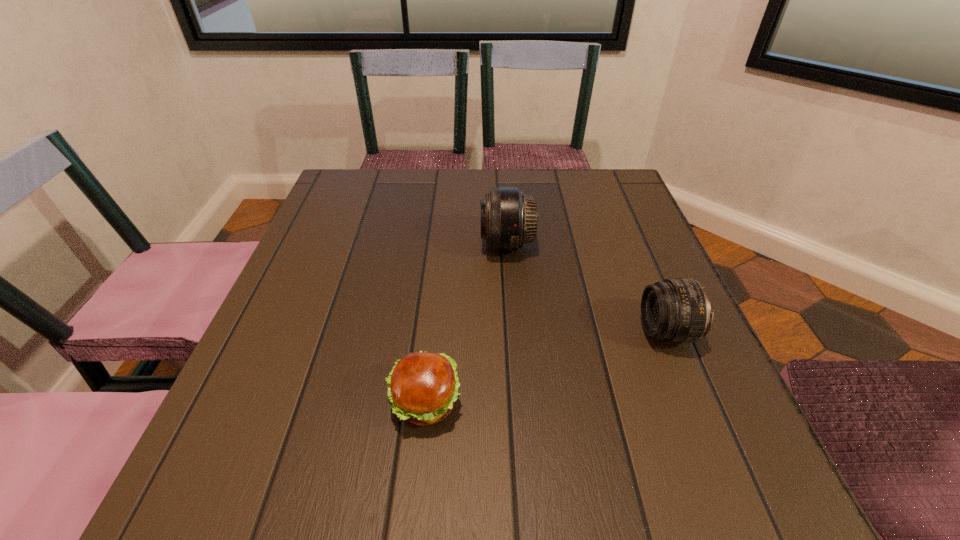
I want to click on free spot located 0.190m at the front element of the rightmost object, so click(539, 332).

Where is `vacant space located at the front element of the rightmost object`? The width and height of the screenshot is (960, 540). vacant space located at the front element of the rightmost object is located at coordinates (582, 332).

Where is `vacant space positioned on the back of the shortest object`? The width and height of the screenshot is (960, 540). vacant space positioned on the back of the shortest object is located at coordinates (434, 320).

I want to click on object located at the right edge, so click(677, 310).

I want to click on free space at the far edge of the desktop, so click(411, 174).

Where is `free space at the near edge of the desktop`? This screenshot has height=540, width=960. free space at the near edge of the desktop is located at coordinates (541, 512).

In the image, there is a desktop. At what (x,y) coordinates should I click in order to perform the action: click on vacant space at the left edge. Please return your answer as a coordinate pair (x, y). This screenshot has width=960, height=540. Looking at the image, I should click on (314, 235).

In the image, there is a desktop. Identify the location of vacant space at the right edge. (633, 339).

This screenshot has width=960, height=540. In the image, there is a desktop. Find the location of `vacant space at the far left corner`. vacant space at the far left corner is located at coordinates (383, 190).

Identify the location of free space at the near left corner of the desktop. The image size is (960, 540). (264, 464).